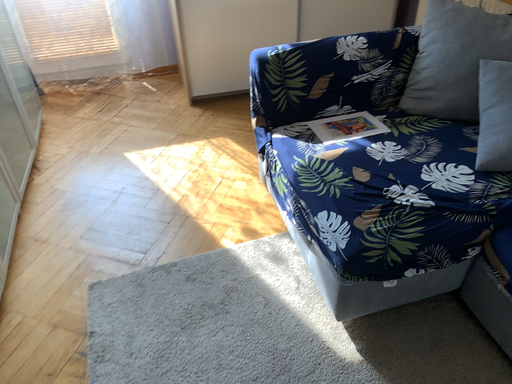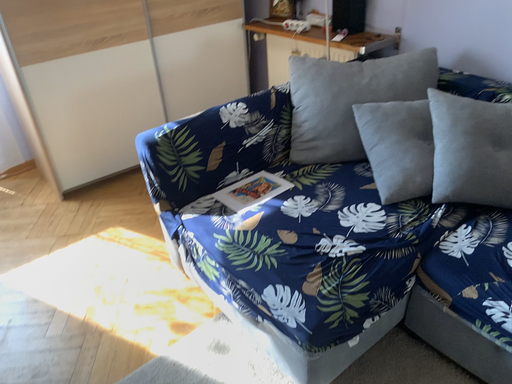
Question: How did the camera likely rotate when shooting the video?

Choices:
 (A) rotated right
 (B) rotated left

Answer: (A)